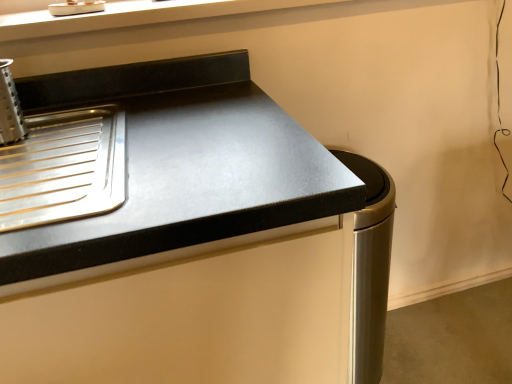
Question: Should I look upward or downward to see black matte countertop at upper left?

Choices:
 (A) up
 (B) down

Answer: (B)

Question: Does satin silver trash can at lower right have a larger size compared to black matte countertop at upper left?

Choices:
 (A) no
 (B) yes

Answer: (A)

Question: From a real-world perspective, is satin silver trash can at lower right positioned under black matte countertop at upper left based on gravity?

Choices:
 (A) yes
 (B) no

Answer: (A)

Question: Is satin silver trash can at lower right behind black matte countertop at upper left?

Choices:
 (A) yes
 (B) no

Answer: (A)

Question: Does satin silver trash can at lower right turn towards black matte countertop at upper left?

Choices:
 (A) yes
 (B) no

Answer: (B)

Question: Is satin silver trash can at lower right wider than black matte countertop at upper left?

Choices:
 (A) yes
 (B) no

Answer: (B)

Question: Can you confirm if satin silver trash can at lower right is taller than black matte countertop at upper left?

Choices:
 (A) no
 (B) yes

Answer: (A)

Question: Does black matte countertop at upper left have a lesser width compared to satin silver trash can at lower right?

Choices:
 (A) no
 (B) yes

Answer: (A)

Question: Can you confirm if black matte countertop at upper left is positioned to the right of satin silver trash can at lower right?

Choices:
 (A) no
 (B) yes

Answer: (A)

Question: From the image's perspective, is black matte countertop at upper left over satin silver trash can at lower right?

Choices:
 (A) yes
 (B) no

Answer: (B)

Question: Would you consider black matte countertop at upper left to be distant from satin silver trash can at lower right?

Choices:
 (A) yes
 (B) no

Answer: (B)

Question: From the image's perspective, does black matte countertop at upper left appear lower than satin silver trash can at lower right?

Choices:
 (A) yes
 (B) no

Answer: (A)

Question: Is satin silver trash can at lower right at the back of black matte countertop at upper left?

Choices:
 (A) yes
 (B) no

Answer: (B)

Question: In the image, is black matte countertop at upper left positioned in front of or behind satin silver trash can at lower right?

Choices:
 (A) front
 (B) behind

Answer: (A)